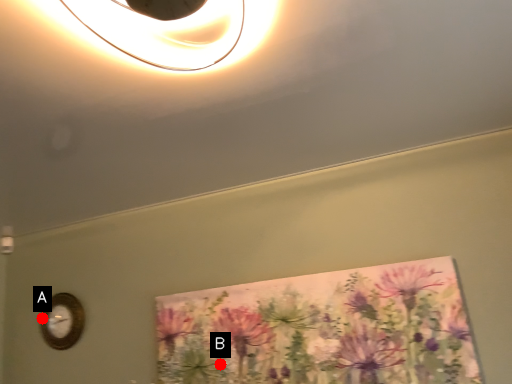
Question: Two points are circled on the image, labeled by A and B beside each circle. Among these points, which one is nearest to the camera?

Choices:
 (A) A is closer
 (B) B is closer

Answer: (B)